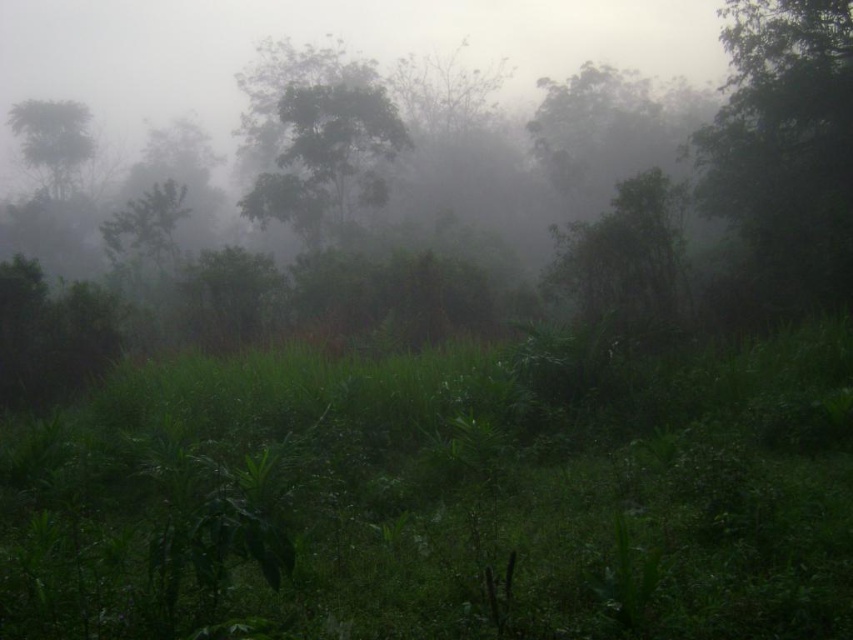
Is green leafy grass at center thinner than green leafy tree at right?

Correct, green leafy grass at center's width is less than green leafy tree at right's.

Describe the element at coordinates (442, 497) in the screenshot. I see `green leafy grass at center` at that location.

Is point (527, 589) farther from viewer compared to point (822, 8)?

No, (527, 589) is in front of (822, 8).

Locate an element on the screen. The height and width of the screenshot is (640, 853). green leafy grass at center is located at coordinates (442, 497).